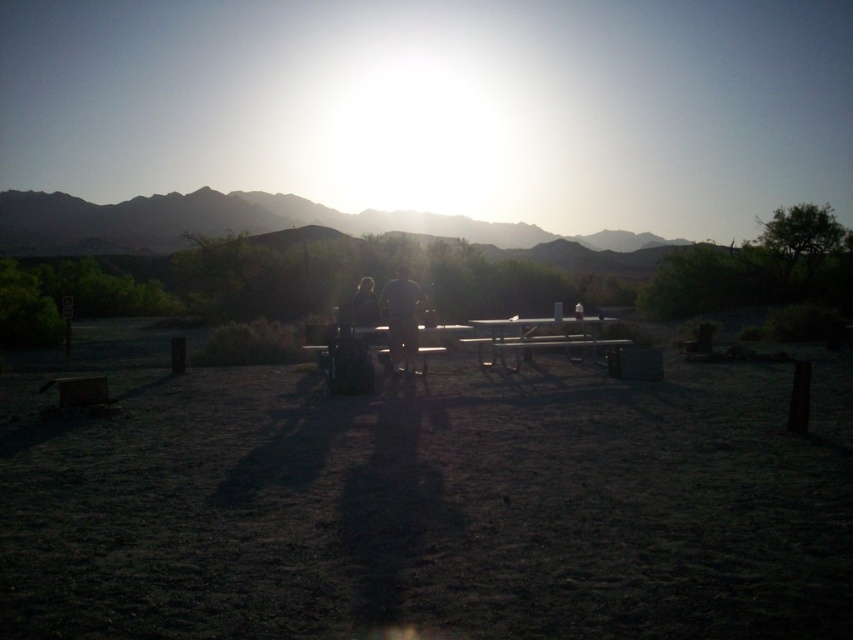
Is point (456, 228) more distant than point (409, 291)?

Yes.

Measure the distance between rugged brown mountain at upper center and matte gray shirt at center.

rugged brown mountain at upper center and matte gray shirt at center are 53.78 meters apart.

Find the location of `rugged brown mountain at upper center`. rugged brown mountain at upper center is located at coordinates (268, 225).

Based on the photo, does dirt field at center have a larger size compared to matte black shirt at center?

No.

Does dirt field at center come behind matte black shirt at center?

No, it is in front of matte black shirt at center.

The width and height of the screenshot is (853, 640). What do you see at coordinates (425, 504) in the screenshot? I see `dirt field at center` at bounding box center [425, 504].

Identify the location of dirt field at center. (425, 504).

Is dirt field at center in front of rugged brown mountain at upper center?

Yes, dirt field at center is closer to the viewer.

Is dirt field at center wider than rugged brown mountain at upper center?

No, dirt field at center is not wider than rugged brown mountain at upper center.

Where is `dirt field at center`? Image resolution: width=853 pixels, height=640 pixels. dirt field at center is located at coordinates (425, 504).